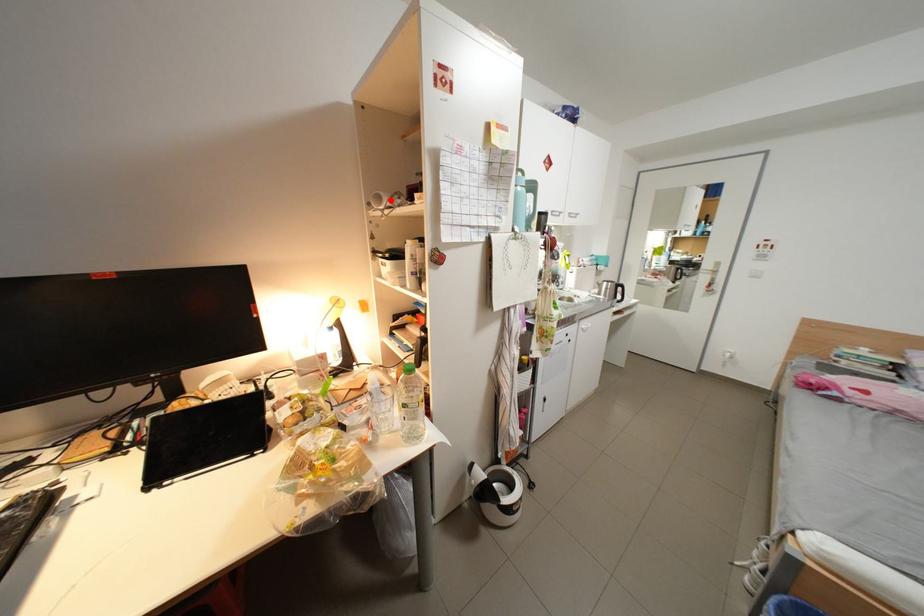
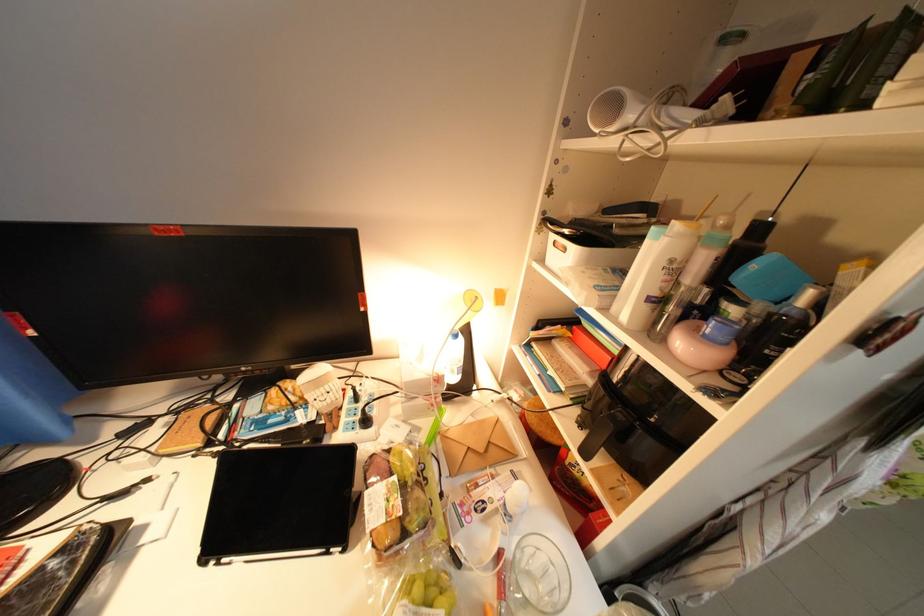
Where in the second image is the point corresponding to the highlighted location from the first image?

(625, 108)